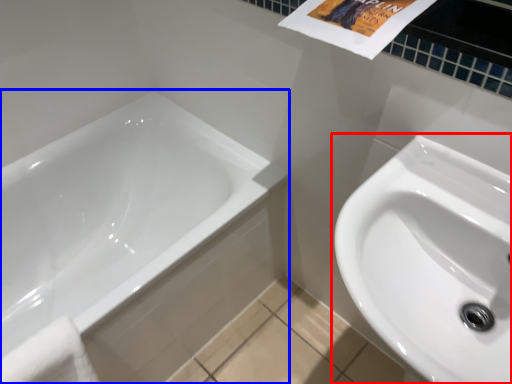
Question: Among these objects, which one is farthest to the camera, sink (highlighted by a red box) or bathtub (highlighted by a blue box)?

Choices:
 (A) sink
 (B) bathtub

Answer: (B)